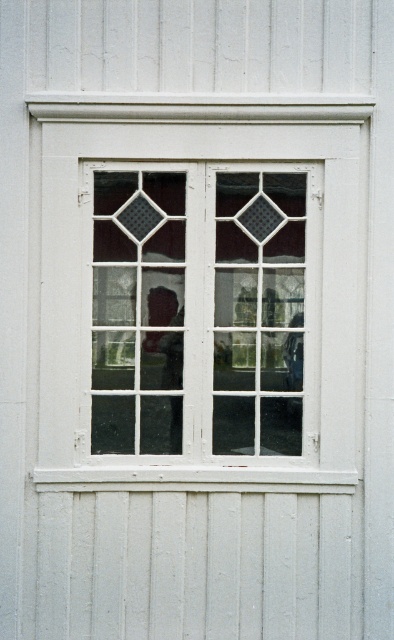
You are an architect designing a new building and want to ensure the white wood window at center and the clear glass window at center fit within a specific space. According to the image, which window has a greater width?

The white wood window at center has a greater width than the clear glass window at center, as stated in the description.

You are standing in front of the building and looking at the window. There are two points marked on the window frame. The first point is at coordinates point (284, 349) and the second is at point (252, 253). Which point appears closer to you?

Point (252, 253) appears closer to you because it is closer to the camera than point (284, 349).